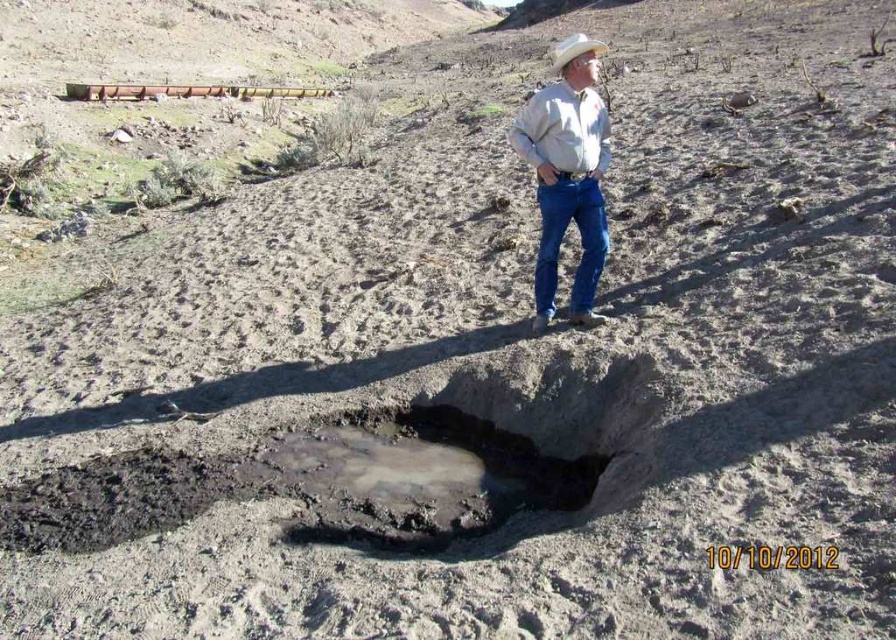
Question: In this image, where is muddy stone hole at center located relative to white matte cowboy hat at upper center?

Choices:
 (A) below
 (B) above

Answer: (A)

Question: Based on their relative distances, which object is farther from the gray cotton shirt at upper right?

Choices:
 (A) muddy stone hole at center
 (B) white matte cowboy hat at upper center

Answer: (B)

Question: Which of the following is the closest to the observer?

Choices:
 (A) (349, 529)
 (B) (564, 52)
 (C) (567, 51)

Answer: (A)

Question: Does muddy stone hole at center appear over white matte cowboy hat at upper center?

Choices:
 (A) no
 (B) yes

Answer: (A)

Question: Among these objects, which one is farthest from the camera?

Choices:
 (A) gray cotton shirt at upper right
 (B) white matte cowboy hat at upper center

Answer: (A)

Question: Is gray cotton shirt at upper right behind white matte cowboy hat at upper center?

Choices:
 (A) yes
 (B) no

Answer: (A)